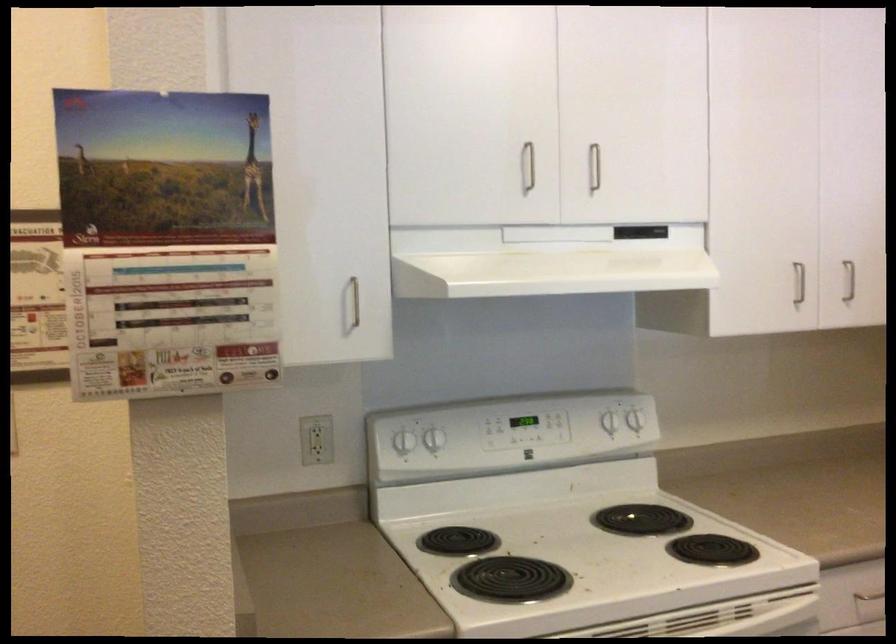
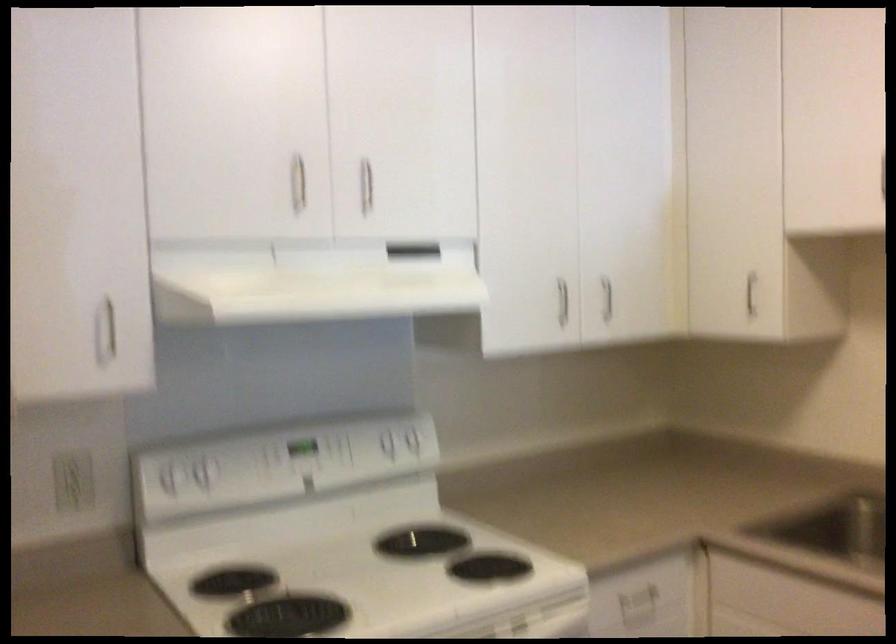
Where in the second image is the point corresponding to the point at 319,438 from the first image?

(73, 480)